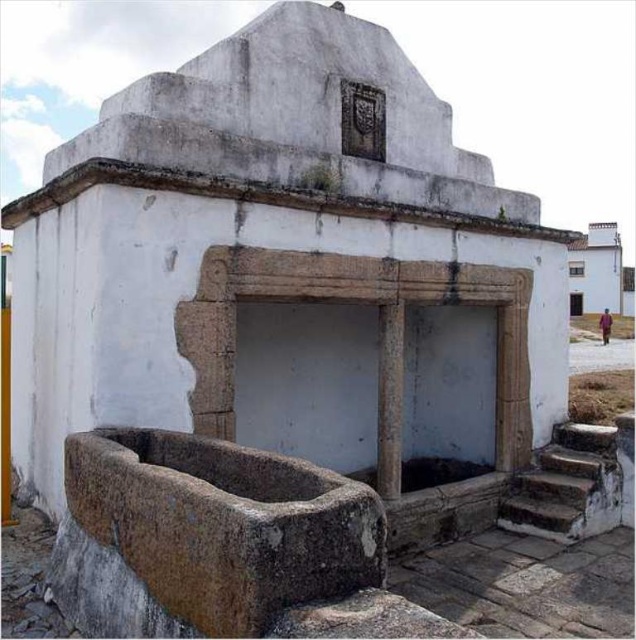
You are standing in front of the old stone structure and want to approach the gray stone pillar at center. Which direction should you move to reach it from the rusty stone stairs at lower right?

The rusty stone stairs at lower right are further to the viewer than the gray stone pillar at center. To reach the gray stone pillar at center, you should move backward away from the stairs towards the structure.

You are standing at the base of the old stone structure and want to reach the triangular pediment at the top. There is a point marked at coordinates (567, 486) which indicates rusty stone stairs at lower right. Can you use these stairs to climb up to the triangular pediment?

The point marked at coordinates (567, 486) indicates rusty stone stairs at lower right. Since the triangular pediment is at the top of the structure, the stairs located at lower right would provide access to climb up to it.